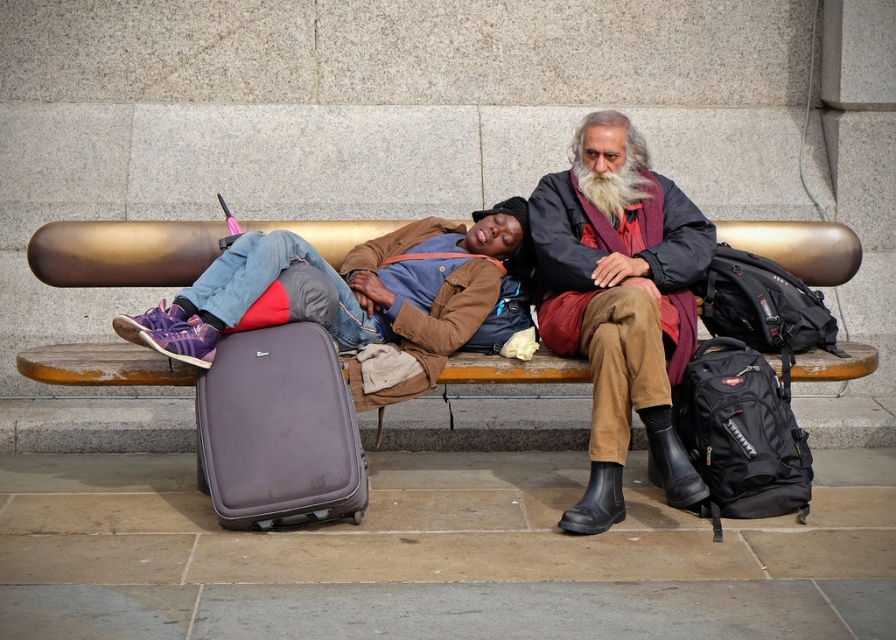
At what (x,y) coordinates should I click in order to perform the action: click on brown suede jacket at center. Please return your answer as a coordinate pair (x, y). The height and width of the screenshot is (640, 896). Looking at the image, I should click on (619, 301).

Which is behind, point (560, 268) or point (332, 380)?

Positioned behind is point (560, 268).

You are a GUI agent. You are given a task and a screenshot of the screen. Output one action in this format:
    pyautogui.click(x=<x>, y=<y>)
    Task: Click on the brown suede jacket at center
    
    Given the screenshot: What is the action you would take?
    pyautogui.click(x=619, y=301)

Locate an element on the screen. brown suede jacket at center is located at coordinates click(x=619, y=301).

Looking at this image, is wooden bench at center closer to the viewer compared to brown suede jacket at center?

No, it is behind brown suede jacket at center.

Does wooden bench at center have a lesser height compared to brown suede jacket at center?

Indeed, wooden bench at center has a lesser height compared to brown suede jacket at center.

At what (x,y) coordinates should I click in order to perform the action: click on wooden bench at center. Please return your answer as a coordinate pair (x, y). Image resolution: width=896 pixels, height=640 pixels. Looking at the image, I should click on (121, 252).

Find the location of a particular element. This screenshot has width=896, height=640. wooden bench at center is located at coordinates (121, 252).

Is wooden bench at center taller than purple matte suitcase at lower left?

In fact, wooden bench at center may be shorter than purple matte suitcase at lower left.

Is wooden bench at center smaller than purple matte suitcase at lower left?

Correct, wooden bench at center occupies less space than purple matte suitcase at lower left.

Which is behind, point (466, 440) or point (242, 396)?

Positioned behind is point (466, 440).

This screenshot has height=640, width=896. In order to click on wooden bench at center in this screenshot , I will do `click(121, 252)`.